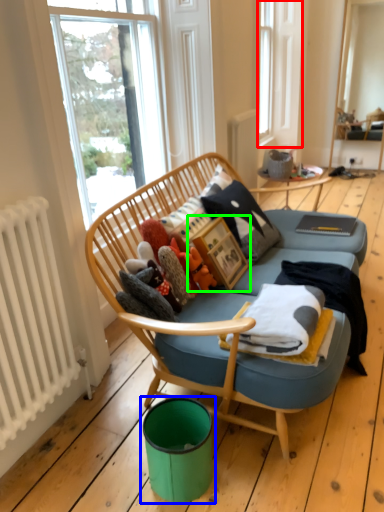
Question: Which is nearer to the bay window (highlighted by a red box)? teal (highlighted by a blue box) or picture frame (highlighted by a green box).

Choices:
 (A) teal
 (B) picture frame

Answer: (B)